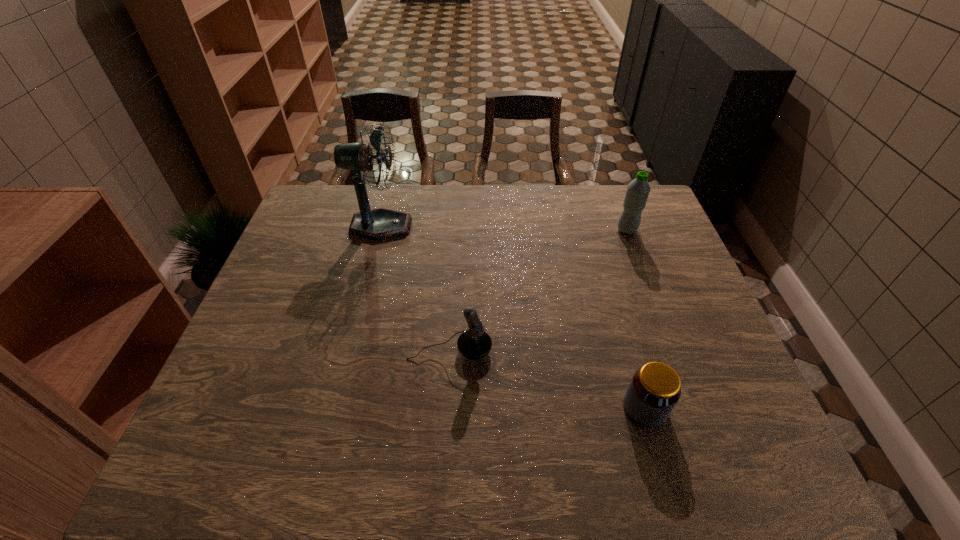
Locate an element on the screen. the leftmost object is located at coordinates (377, 224).

Locate an element on the screen. The height and width of the screenshot is (540, 960). the tallest object is located at coordinates (377, 224).

You are a GUI agent. You are given a task and a screenshot of the screen. Output one action in this format:
    pyautogui.click(x=<x>, y=<y>)
    Task: Click on the rightmost object
    
    Given the screenshot: What is the action you would take?
    pyautogui.click(x=638, y=190)

Locate an element on the screen. The width and height of the screenshot is (960, 540). the third shortest object is located at coordinates (638, 190).

Identify the location of microphone. (474, 343).

The image size is (960, 540). I want to click on the third tallest object, so click(x=474, y=343).

Locate an element on the screen. This screenshot has width=960, height=540. the nearest object is located at coordinates (655, 388).

The height and width of the screenshot is (540, 960). I want to click on the shortest object, so click(x=655, y=388).

Where is `free space located in front of the leftmost object where the wind blows`? The image size is (960, 540). free space located in front of the leftmost object where the wind blows is located at coordinates (517, 226).

Identify the location of free spot located 0.200m on the front of the third shortest object. The image size is (960, 540). (646, 282).